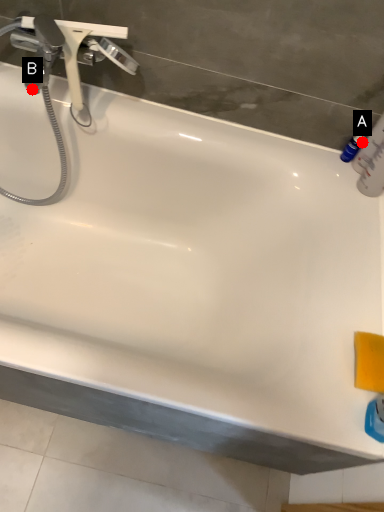
Question: Two points are circled on the image, labeled by A and B beside each circle. Which point is closer to the camera taking this photo?

Choices:
 (A) A is closer
 (B) B is closer

Answer: (A)